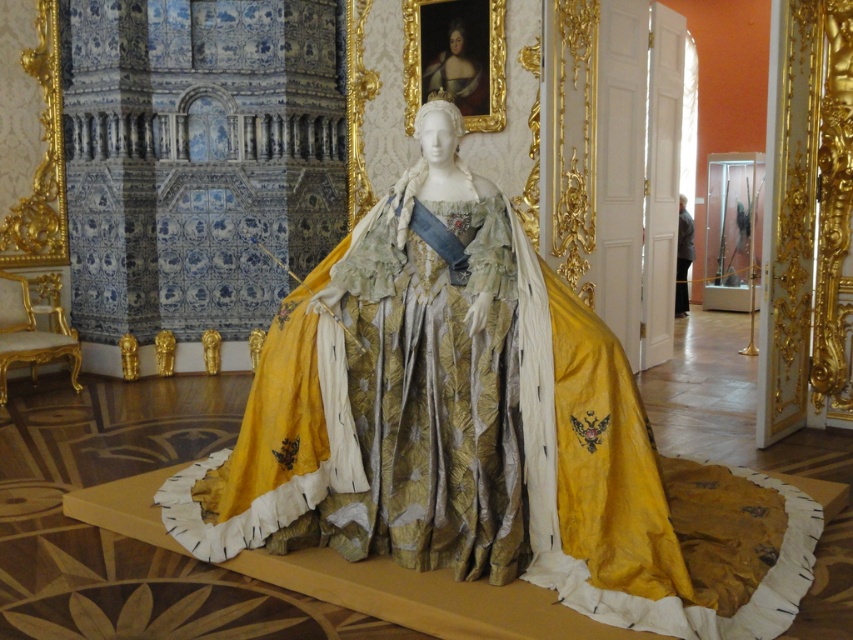
Can you confirm if smooth gold crown at upper center is positioned to the right of gold satin gown at center?

In fact, smooth gold crown at upper center is to the left of gold satin gown at center.

Looking at this image, between smooth gold crown at upper center and gold satin gown at center, which one is positioned lower?

gold satin gown at center is below.

Between point (457, 64) and point (688, 260), which one is positioned in front?

Point (457, 64) is in front.

You are a GUI agent. You are given a task and a screenshot of the screen. Output one action in this format:
    pyautogui.click(x=<x>, y=<y>)
    Task: Click on the smooth gold crown at upper center
    
    Given the screenshot: What is the action you would take?
    pyautogui.click(x=456, y=70)